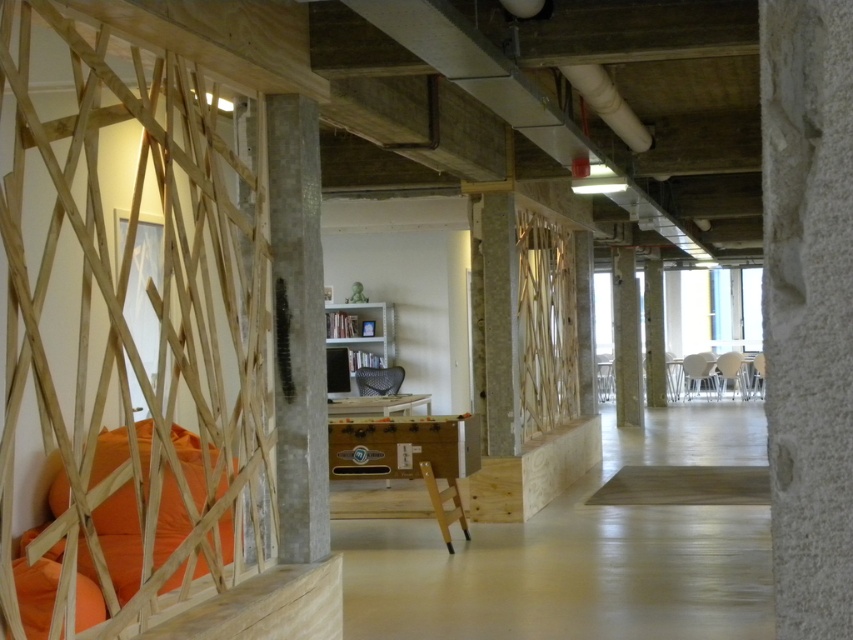
You are organizing a small event in this office space and need to place a large decorative item. Given the orange fabric pillow at left and the concrete column at center, which object can accommodate a larger item due to its size?

The concrete column at center can accommodate a larger item because it has a bigger size compared to the orange fabric pillow at left.